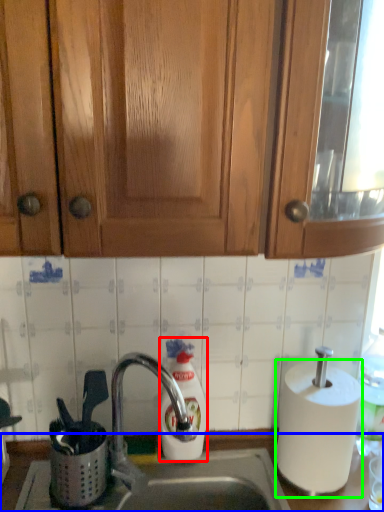
Question: Considering the real-world distances, which object is farthest from soap dispenser (highlighted by a red box)? counter (highlighted by a blue box) or paper towel (highlighted by a green box)?

Choices:
 (A) counter
 (B) paper towel

Answer: (B)